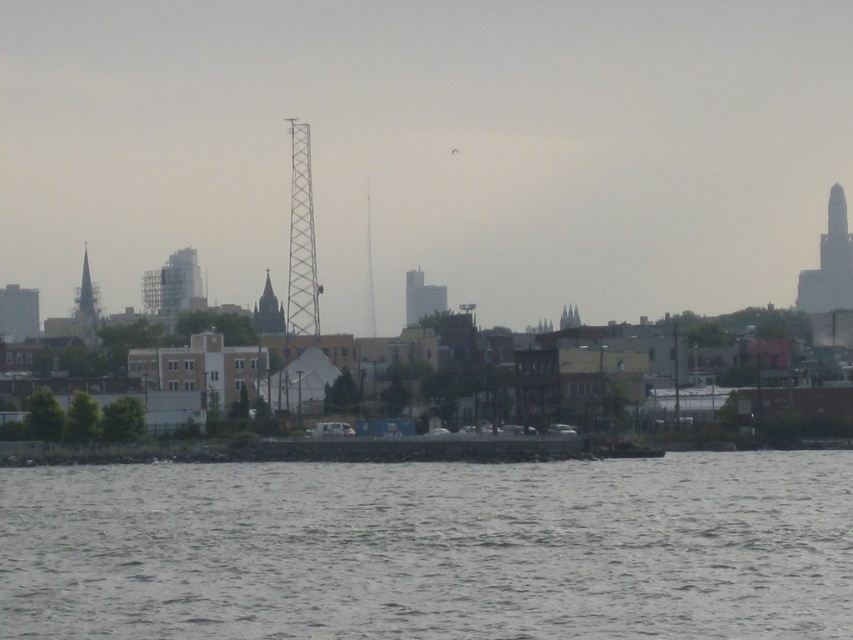
Question: Can you confirm if glassy reflective building at center is positioned to the right of smooth gray tower at center?

Choices:
 (A) no
 (B) yes

Answer: (A)

Question: Does glassy reflective building at center appear on the left side of dark gray stone spire at center?

Choices:
 (A) no
 (B) yes

Answer: (B)

Question: Which object appears farthest from the camera in this image?

Choices:
 (A) smooth gray tower at center
 (B) metallic gray tower at left

Answer: (B)

Question: Which point is closer to the camera?

Choices:
 (A) (413, 296)
 (B) (241, 593)
 (C) (6, 332)
 (D) (265, 323)

Answer: (B)

Question: Which of the following is the farthest from the observer?

Choices:
 (A) smooth glass skyscraper at right
 (B) metallic gray tower at left

Answer: (A)

Question: Does smooth glass skyscraper at right appear on the right side of dark gray stone spire at center?

Choices:
 (A) no
 (B) yes

Answer: (B)